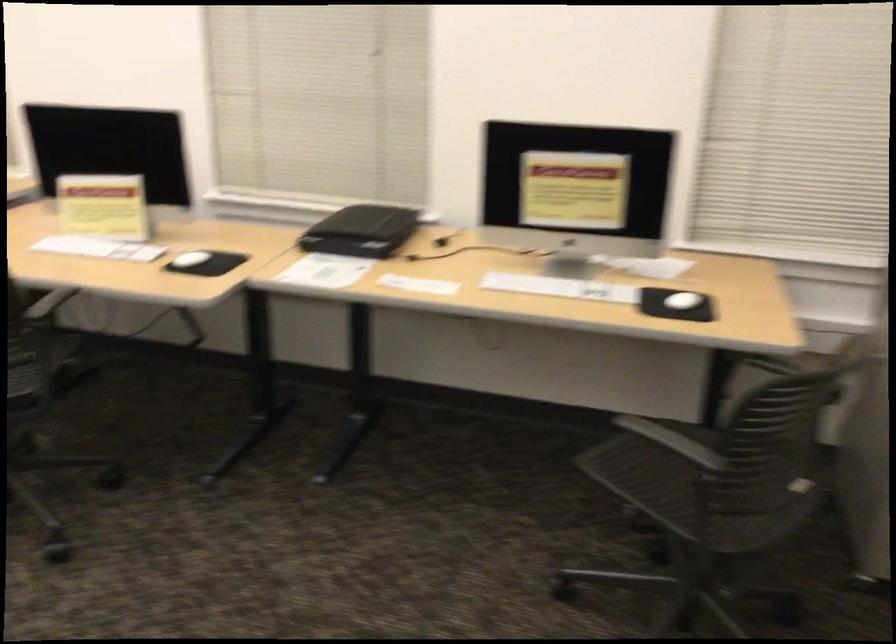
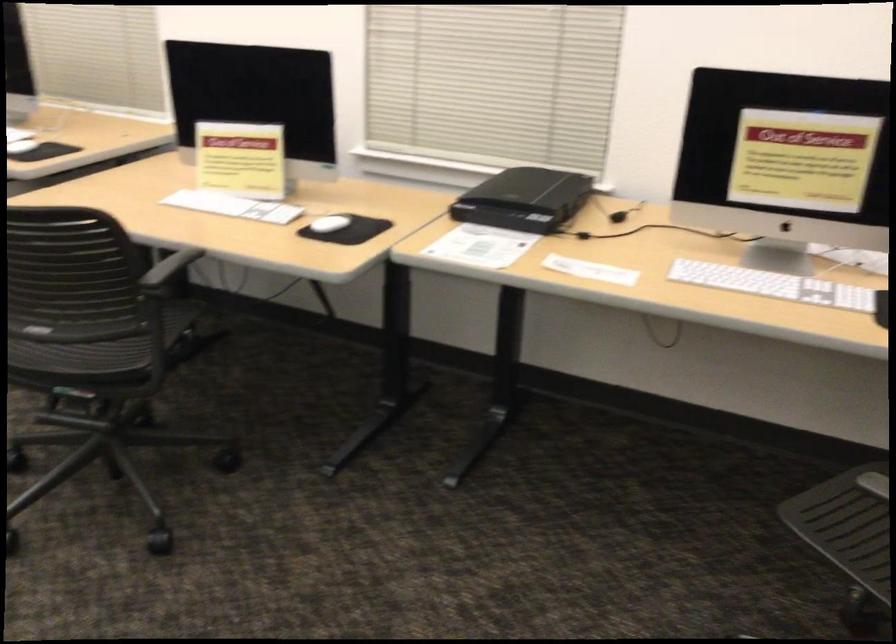
Question: The images are taken continuously from a first-person perspective. In which direction is your viewpoint rotating?

Choices:
 (A) Left
 (B) Right
 (C) Up
 (D) Down

Answer: (A)